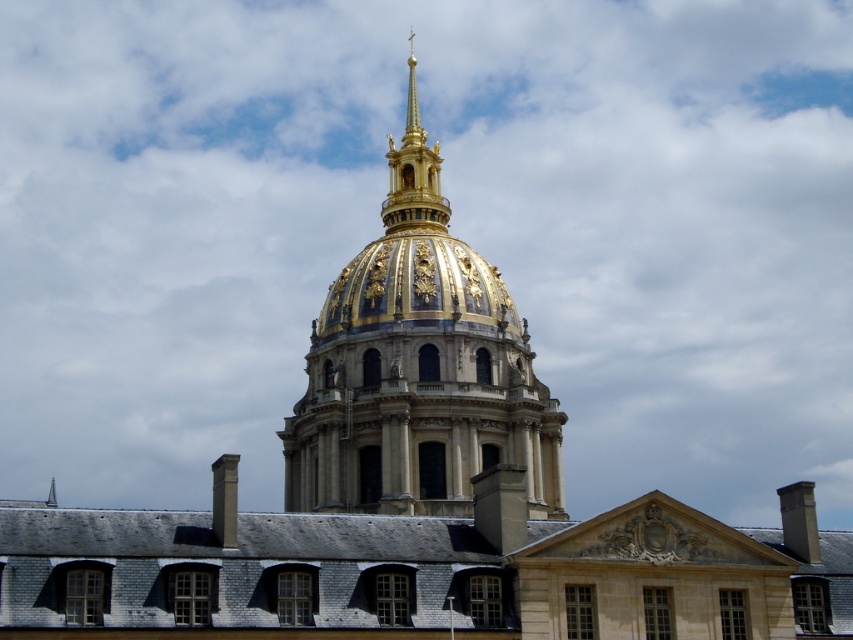
Question: Which point is farther to the camera?

Choices:
 (A) (387, 161)
 (B) (375, 301)

Answer: (A)

Question: Which point appears closest to the camera in this image?

Choices:
 (A) (450, 417)
 (B) (383, 221)

Answer: (A)

Question: Does gold/gilded dome at center have a greater width compared to gold/gilded metal spire at upper center?

Choices:
 (A) no
 (B) yes

Answer: (B)

Question: From the image, what is the correct spatial relationship of gold/gilded dome at center in relation to gold/gilded metal spire at upper center?

Choices:
 (A) right
 (B) left

Answer: (A)

Question: Among these objects, which one is farthest from the camera?

Choices:
 (A) gold/gilded dome at center
 (B) gold/gilded metal spire at upper center

Answer: (B)

Question: Does gold/gilded dome at center appear over gold/gilded metal spire at upper center?

Choices:
 (A) no
 (B) yes

Answer: (A)